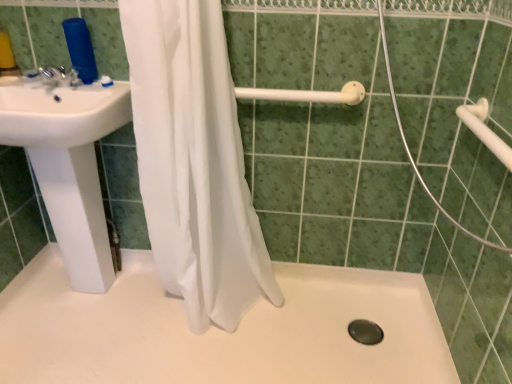
Where is `free point to the right of white sheer curtain at center`? free point to the right of white sheer curtain at center is located at coordinates click(317, 327).